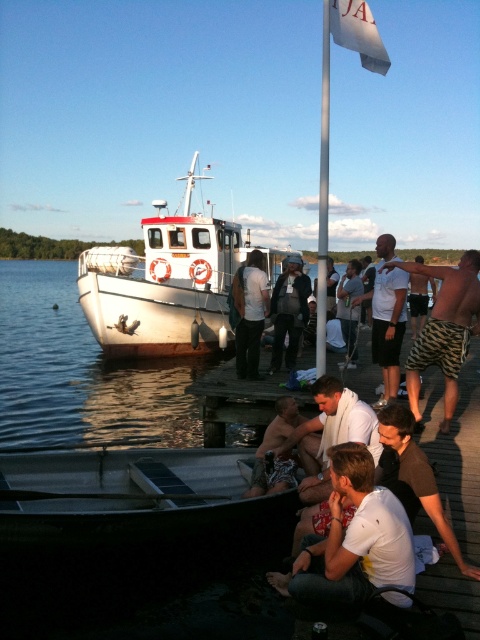
Who is shorter, white glossy water at boat left or white matte boat at center?

With less height is white glossy water at boat left.

Can you confirm if white glossy water at boat left is bigger than white matte boat at center?

Yes.

Image resolution: width=480 pixels, height=640 pixels. In order to click on white glossy water at boat left in this screenshot , I will do `click(81, 371)`.

Which of these two, white matte shirt at center or dark gray fabric jacket at center, stands shorter?

With less height is dark gray fabric jacket at center.

Image resolution: width=480 pixels, height=640 pixels. Identify the location of white matte shirt at center. (386, 317).

Find the location of a particular element. white matte shirt at center is located at coordinates (386, 317).

At what (x,y) coordinates should I click in order to perform the action: click on white matte shirt at lower center. Please return your answer as a coordinate pair (x, y). This screenshot has height=640, width=480. Looking at the image, I should click on (354, 538).

Does white matte shirt at lower center have a greater width compared to white towel at center?

In fact, white matte shirt at lower center might be narrower than white towel at center.

Who is more forward, [320,600] or [365,419]?

Point [320,600]

Where is `white matte shirt at lower center`? white matte shirt at lower center is located at coordinates (354, 538).